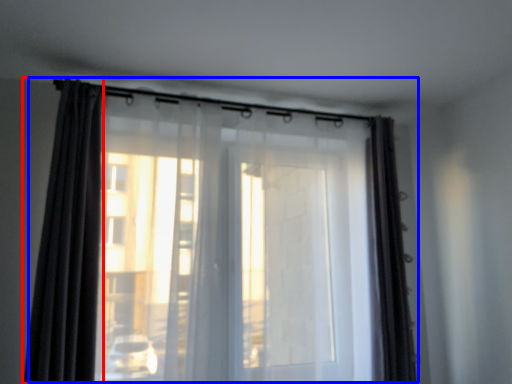
Question: Which point is further to the camera, curtain (highlighted by a red box) or curtain (highlighted by a blue box)?

Choices:
 (A) curtain
 (B) curtain

Answer: (B)